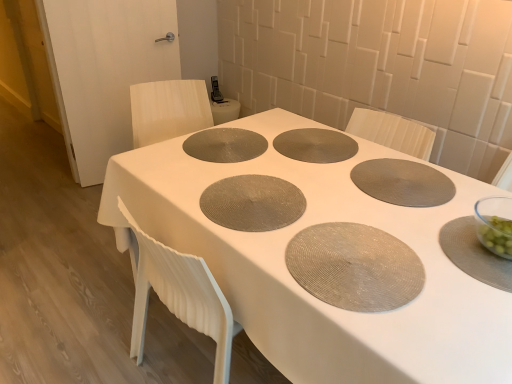
You are a GUI agent. You are given a task and a screenshot of the screen. Output one action in this format:
    pyautogui.click(x=<x>, y=<y>)
    Task: Click on the vacant space in front of matte gray placemat at center, positioned as the second pizza pan in right-to-left order
    
    Given the screenshot: What is the action you would take?
    pyautogui.click(x=314, y=172)